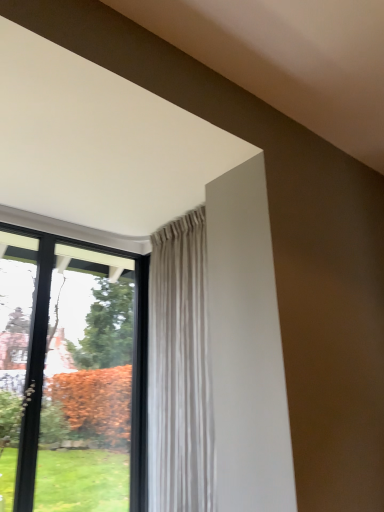
Question: From the image's perspective, does black glass window at left appear lower than beige textured curtain at upper center?

Choices:
 (A) no
 (B) yes

Answer: (B)

Question: From a real-world perspective, is black glass window at left physically below beige textured curtain at upper center?

Choices:
 (A) no
 (B) yes

Answer: (B)

Question: From a real-world perspective, is black glass window at left on top of beige textured curtain at upper center?

Choices:
 (A) no
 (B) yes

Answer: (A)

Question: Are black glass window at left and beige textured curtain at upper center beside each other?

Choices:
 (A) no
 (B) yes

Answer: (A)

Question: Is black glass window at left positioned before beige textured curtain at upper center?

Choices:
 (A) yes
 (B) no

Answer: (B)

Question: Can beige textured curtain at upper center be found inside black glass window at left?

Choices:
 (A) yes
 (B) no

Answer: (B)

Question: Considering the relative positions of beige textured curtain at upper center and black glass window at left in the image provided, is beige textured curtain at upper center to the left of black glass window at left from the viewer's perspective?

Choices:
 (A) yes
 (B) no

Answer: (B)

Question: Would you say black glass window at left is part of beige textured curtain at upper center's contents?

Choices:
 (A) yes
 (B) no

Answer: (B)

Question: Does beige textured curtain at upper center have a greater height compared to black glass window at left?

Choices:
 (A) yes
 (B) no

Answer: (A)

Question: From a real-world perspective, does beige textured curtain at upper center stand above black glass window at left?

Choices:
 (A) yes
 (B) no

Answer: (A)

Question: Is the position of beige textured curtain at upper center less distant than that of black glass window at left?

Choices:
 (A) yes
 (B) no

Answer: (A)

Question: Is beige textured curtain at upper center far away from black glass window at left?

Choices:
 (A) yes
 (B) no

Answer: (B)

Question: Is black glass window at left bigger or smaller than beige textured curtain at upper center?

Choices:
 (A) small
 (B) big

Answer: (A)